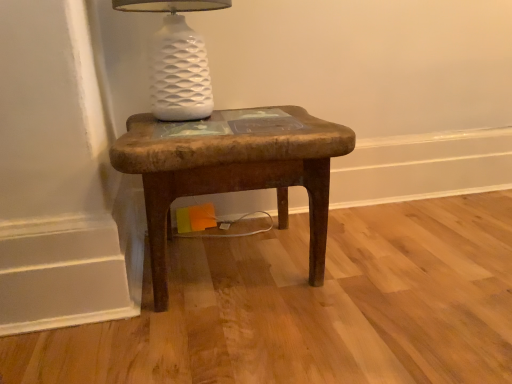
Question: Is point (181, 97) closer or farther from the camera than point (279, 205)?

Choices:
 (A) closer
 (B) farther

Answer: (A)

Question: Considering the positions of white ceramic lamp at upper center and rustic wood stool at center in the image, is white ceramic lamp at upper center wider or thinner than rustic wood stool at center?

Choices:
 (A) thin
 (B) wide

Answer: (A)

Question: In terms of size, does white ceramic lamp at upper center appear bigger or smaller than rustic wood stool at center?

Choices:
 (A) small
 (B) big

Answer: (A)

Question: Is point (139, 145) closer or farther from the camera than point (169, 16)?

Choices:
 (A) farther
 (B) closer

Answer: (B)

Question: In terms of size, does rustic wood stool at center appear bigger or smaller than white ceramic lamp at upper center?

Choices:
 (A) big
 (B) small

Answer: (A)

Question: Is rustic wood stool at center taller or shorter than white ceramic lamp at upper center?

Choices:
 (A) short
 (B) tall

Answer: (B)

Question: Is rustic wood stool at center spatially inside white ceramic lamp at upper center, or outside of it?

Choices:
 (A) outside
 (B) inside

Answer: (A)